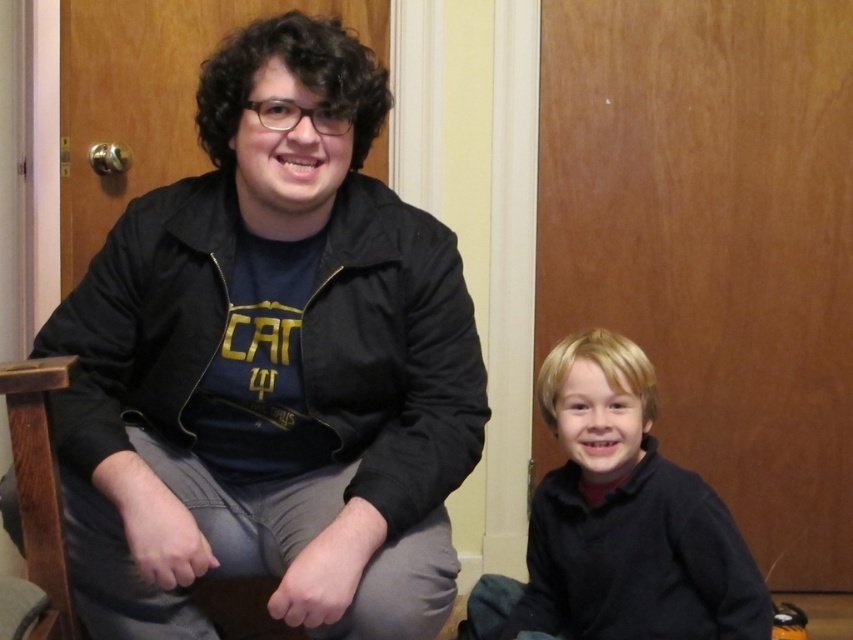
Question: Does black matte jacket at left appear on the left side of wooden textured rocking chair at left?

Choices:
 (A) no
 (B) yes

Answer: (A)

Question: Does black matte jacket at left lie in front of wooden textured rocking chair at left?

Choices:
 (A) no
 (B) yes

Answer: (B)

Question: Which of the following is the farthest from the observer?

Choices:
 (A) (279, 509)
 (B) (529, 522)
 (C) (45, 534)

Answer: (B)

Question: Is black matte sweater at lower right positioned in front of wooden textured rocking chair at left?

Choices:
 (A) yes
 (B) no

Answer: (B)

Question: Which of the following is the farthest from the observer?

Choices:
 (A) (44, 618)
 (B) (544, 550)

Answer: (B)

Question: Which point is closer to the camera?

Choices:
 (A) (363, 483)
 (B) (701, 496)

Answer: (A)